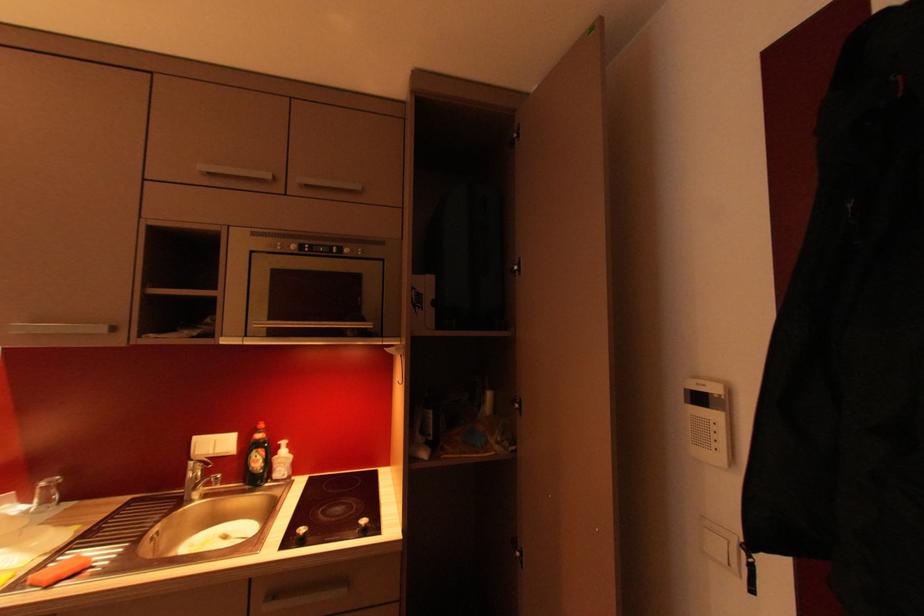
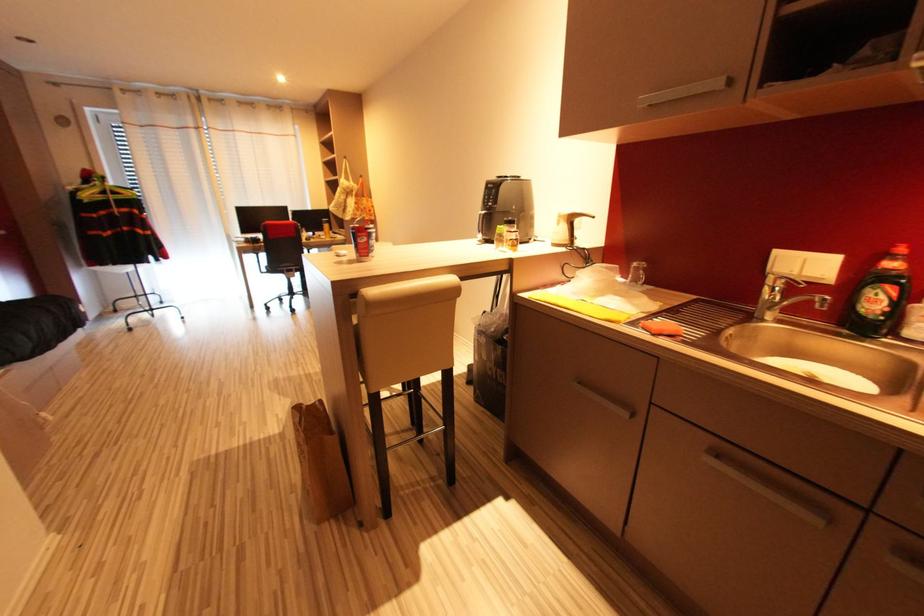
Based on the continuous images, in which direction is the camera rotating?

The camera's rotation is toward left-down.